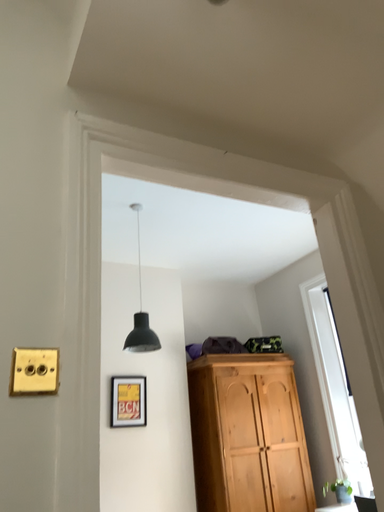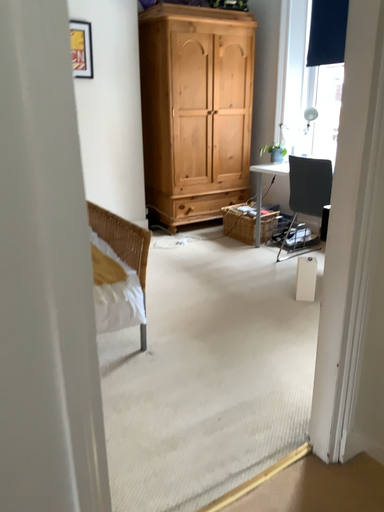
Question: How did the camera likely rotate when shooting the video?

Choices:
 (A) rotated upward
 (B) rotated downward

Answer: (B)